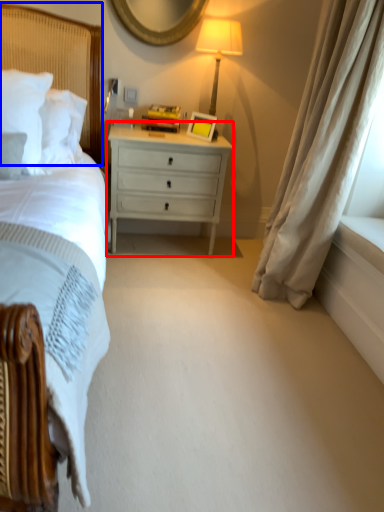
Question: Which of the following is the farthest to the observer, nightstand (highlighted by a red box) or headboard (highlighted by a blue box)?

Choices:
 (A) nightstand
 (B) headboard

Answer: (A)